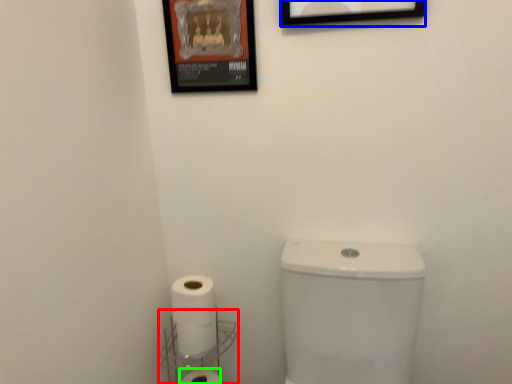
Question: Which is nearer to the shelf (highlighted by a red box)? picture frame (highlighted by a blue box) or toilet paper (highlighted by a green box).

Choices:
 (A) picture frame
 (B) toilet paper

Answer: (B)